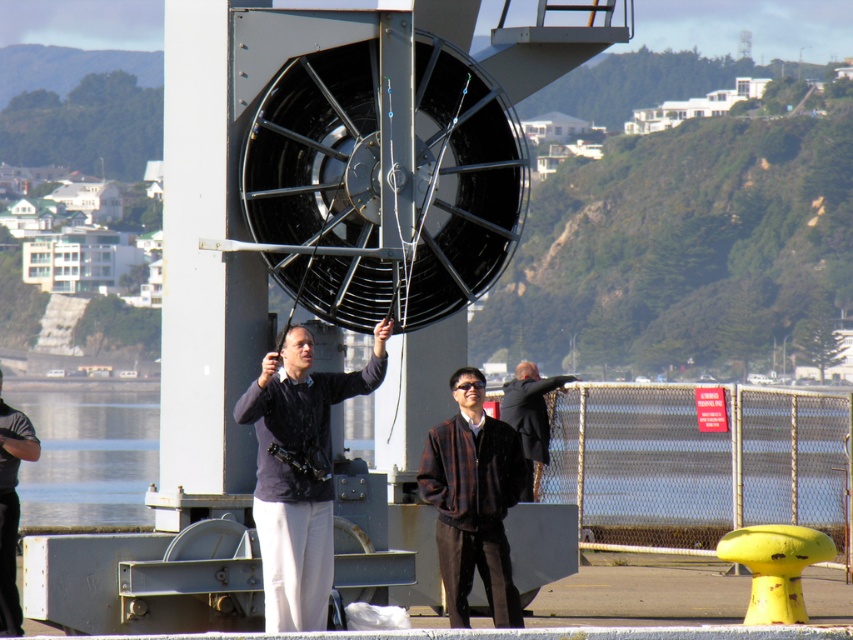
You are standing on the dock and want to know if the clear water at lower left is higher or lower than the dark brown leather jacket at center. Based on the scene, can you determine their relative heights?

The clear water at lower left is much taller than the dark brown leather jacket at center, so the water is higher in height compared to the jacket.

You are standing at the point marked by coordinates point (x=88, y=456). What do you see around you?

At point (x=88, y=456), you are surrounded by clear water at lower left.

You are a photographer trying to capture a clear shot of the dark brown leather jacket at center without the dark gray fabric pants at lower left blocking it. Is this possible given their current positions?

The dark gray fabric pants at lower left is positioned over the dark brown leather jacket at center, so it is blocking the jacket. To capture a clear shot of the jacket without the pants blocking it, you would need to adjust your angle or move the pants out of the way.